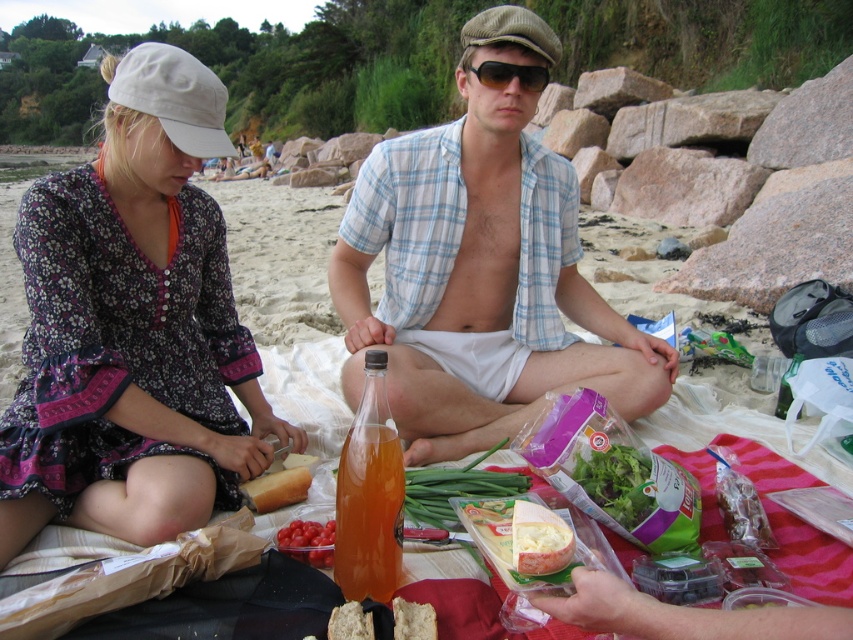
Question: Considering the relative positions of green leafy salad at center and sunglasses at center in the image provided, where is green leafy salad at center located with respect to sunglasses at center?

Choices:
 (A) left
 (B) right

Answer: (B)

Question: Is floral fabric dress at lower left in front of white creamy cheese at center?

Choices:
 (A) no
 (B) yes

Answer: (A)

Question: Is red glossy cherry tomatoes at center bigger than sunglasses at center?

Choices:
 (A) yes
 (B) no

Answer: (B)

Question: Which point is closer to the camera?

Choices:
 (A) click(291, 531)
 (B) click(430, 307)
 (C) click(618, 468)

Answer: (A)

Question: Considering the real-world distances, which object is closest to the translucent orange liquid at center?

Choices:
 (A) floral fabric dress at lower left
 (B) green leafy salad at center

Answer: (B)

Question: Among these points, which one is nearest to the camera?

Choices:
 (A) (415, 604)
 (B) (641, 509)
 (C) (33, 458)
 (D) (369, 586)

Answer: (A)